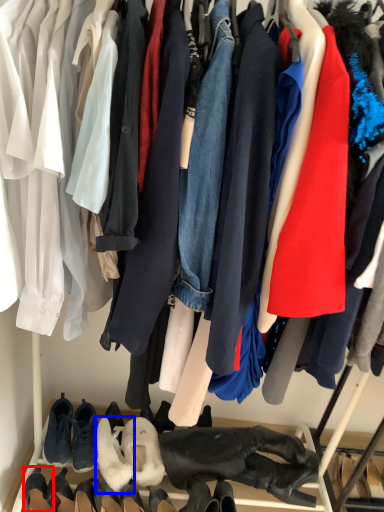
Question: Which object appears closest to the camera in this image, footwear (highlighted by a red box) or footwear (highlighted by a blue box)?

Choices:
 (A) footwear
 (B) footwear

Answer: (A)